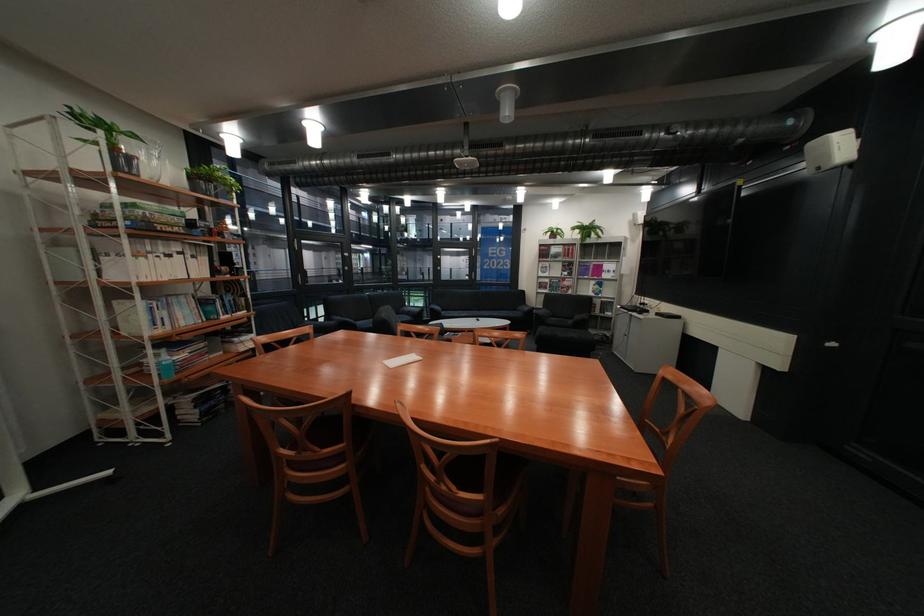
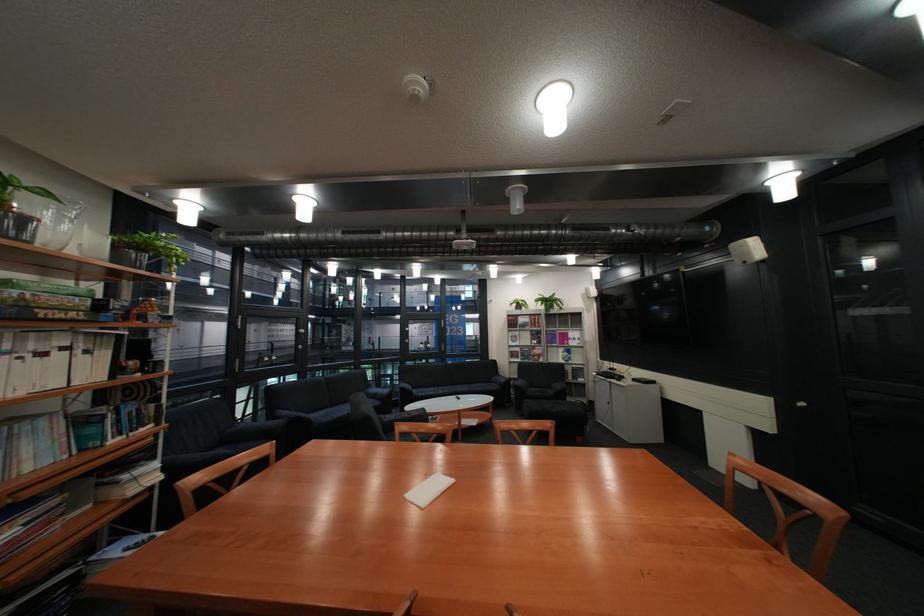
In a continuous first-person perspective shot, in which direction is the camera moving?

The movement direction of the cameraman is left, forward.